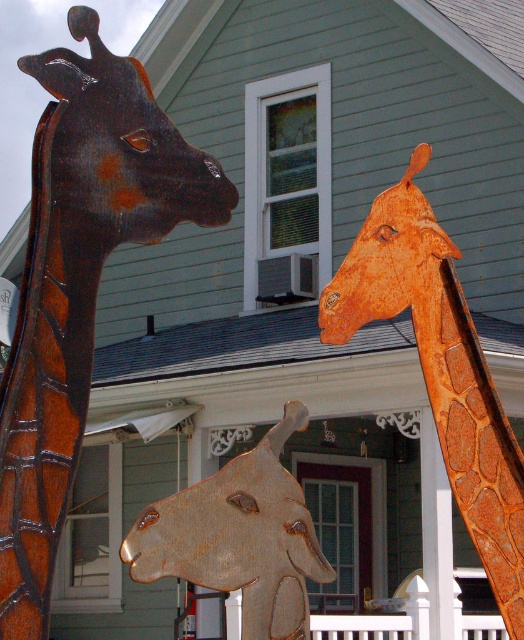
Question: Which is nearer to the rusty metal giraffe at upper left?

Choices:
 (A) rusty wood giraffe head at center
 (B) rusty metal giraffe at upper right

Answer: (A)

Question: In this image, where is rusty metal giraffe at upper left located relative to rusty metal giraffe at upper right?

Choices:
 (A) above
 (B) below

Answer: (B)

Question: Which point is closer to the camera?

Choices:
 (A) (49, 588)
 (B) (449, 291)
 (C) (187, 557)

Answer: (A)

Question: Which object is positioned closest to the rusty metal giraffe at upper left?

Choices:
 (A) rusty wood giraffe head at center
 (B) rusty metal giraffe at upper right

Answer: (A)

Question: Is rusty metal giraffe at upper left to the left of rusty wood giraffe head at center from the viewer's perspective?

Choices:
 (A) no
 (B) yes

Answer: (B)

Question: Does rusty metal giraffe at upper left have a greater width compared to rusty metal giraffe at upper right?

Choices:
 (A) yes
 (B) no

Answer: (B)